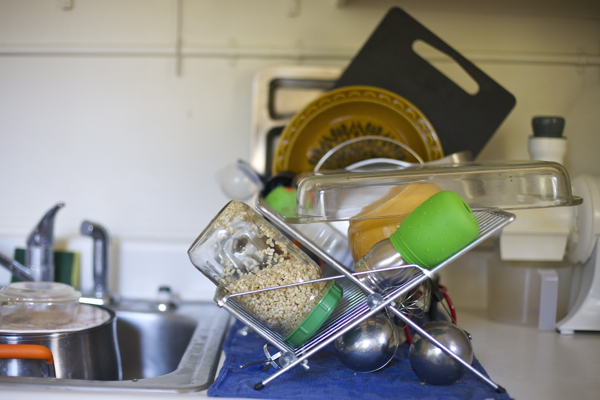
You are a GUI agent. You are given a task and a screenshot of the screen. Output one action in this format:
    pyautogui.click(x=<x>, y=<y>)
    Task: Click on the white counter top
    
    Given the screenshot: What is the action you would take?
    pyautogui.click(x=554, y=376)